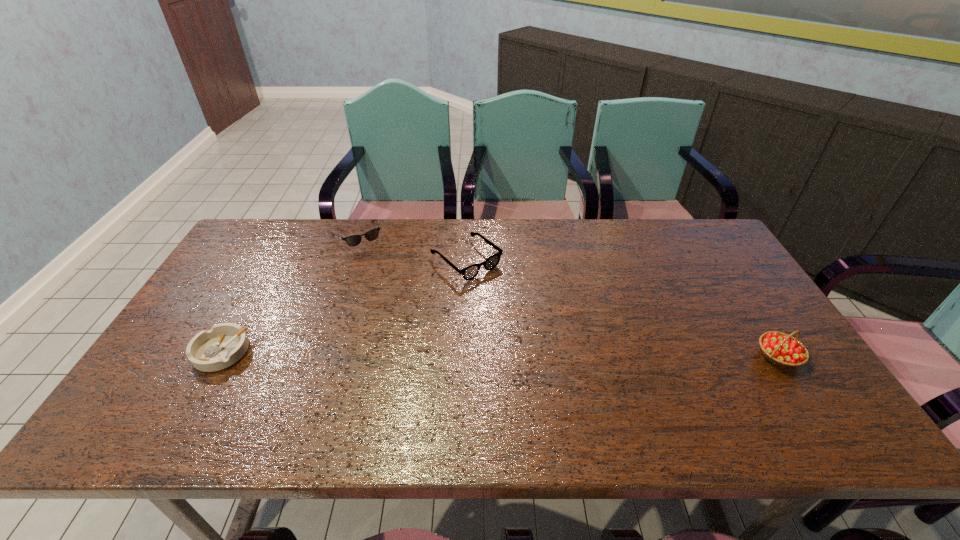
Locate an element on the screen. object that is positioned at the near left corner is located at coordinates (223, 345).

Find the location of `object located in the near right corner section of the desktop`. object located in the near right corner section of the desktop is located at coordinates (782, 349).

I want to click on vacant space at the far edge of the desktop, so click(525, 251).

Locate an element on the screen. The height and width of the screenshot is (540, 960). free location at the near edge is located at coordinates (412, 386).

In the image, there is a desktop. Where is `vacant space at the left edge`? This screenshot has height=540, width=960. vacant space at the left edge is located at coordinates (212, 287).

Where is `free space at the right edge of the desktop`? This screenshot has width=960, height=540. free space at the right edge of the desktop is located at coordinates (696, 265).

What are the coordinates of `vacant space at the far left corner of the desktop` in the screenshot? It's located at (277, 233).

Where is `free region at the near right corner of the desktop`? Image resolution: width=960 pixels, height=540 pixels. free region at the near right corner of the desktop is located at coordinates (792, 389).

The height and width of the screenshot is (540, 960). In order to click on free space between the leftmost object and the third object from right to left in this screenshot , I will do `click(289, 294)`.

Identify the location of free point between the shortest object and the second object from right to left. [x=344, y=306].